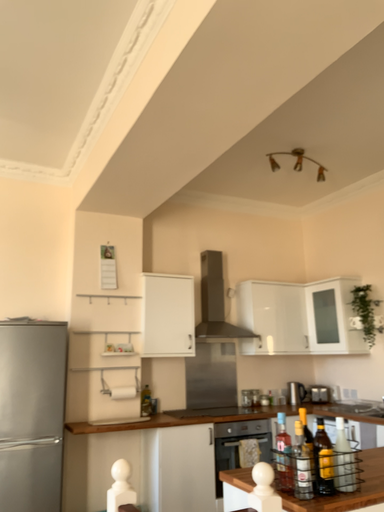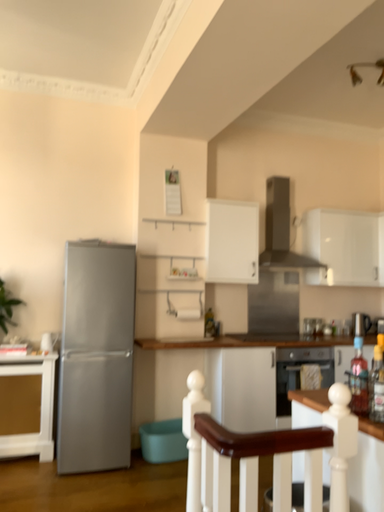
Question: How did the camera likely rotate when shooting the video?

Choices:
 (A) rotated upward
 (B) rotated downward

Answer: (B)